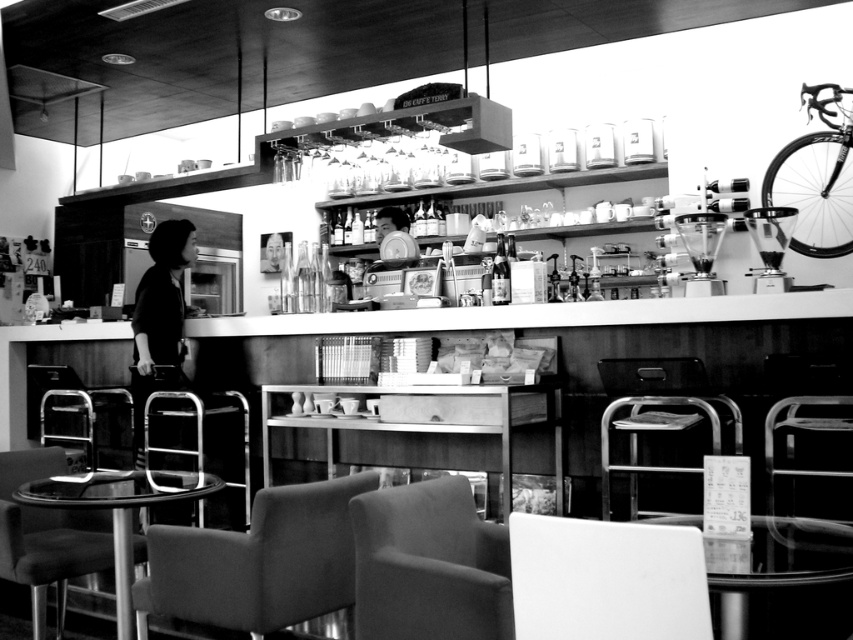
Which is behind, point (703, 582) or point (686, 468)?

Positioned behind is point (686, 468).

Between point (666, 595) and point (601, 428), which one is positioned in front?

Point (666, 595)

Locate an element on the screen. Image resolution: width=853 pixels, height=640 pixels. white matte chair at lower center is located at coordinates (606, 579).

Can you confirm if suede-like fabric chair at lower center is taller than white matte chair at lower center?

Correct, suede-like fabric chair at lower center is much taller as white matte chair at lower center.

Between point (350, 540) and point (566, 636), which one is positioned in front?

Point (566, 636)

The width and height of the screenshot is (853, 640). Find the location of `suede-like fabric chair at lower center`. suede-like fabric chair at lower center is located at coordinates (257, 563).

Can you confirm if smooth glass table at center is positioned to the right of glassy clear table at lower left?

Indeed, smooth glass table at center is positioned on the right side of glassy clear table at lower left.

From the picture: Is smooth glass table at center smaller than glassy clear table at lower left?

Correct, smooth glass table at center occupies less space than glassy clear table at lower left.

Which is in front, point (762, 636) or point (120, 532)?

Positioned in front is point (120, 532).

I want to click on smooth glass table at center, so click(782, 580).